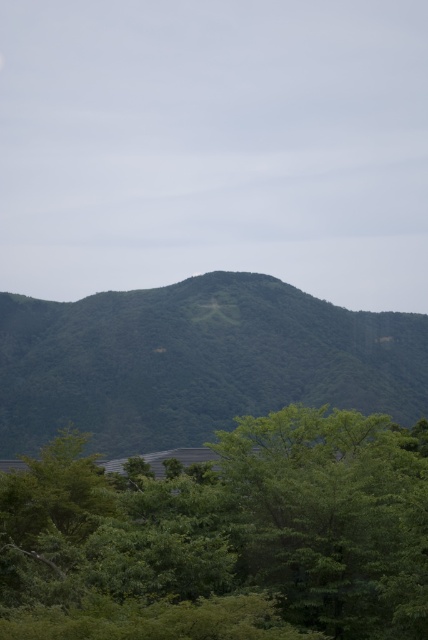
You are standing at the point labeled as point [225,536] in the image. Looking around, you see a green leafy tree at lower center. Which direction should you face to see the mountain range in the background?

The point [225,536] is located at the green leafy tree at lower center. To see the mountain range in the background, you should face towards the background, which is behind the tree. Since the mountain range is in the background, facing away from the tree towards the horizon would allow you to view the mountains.